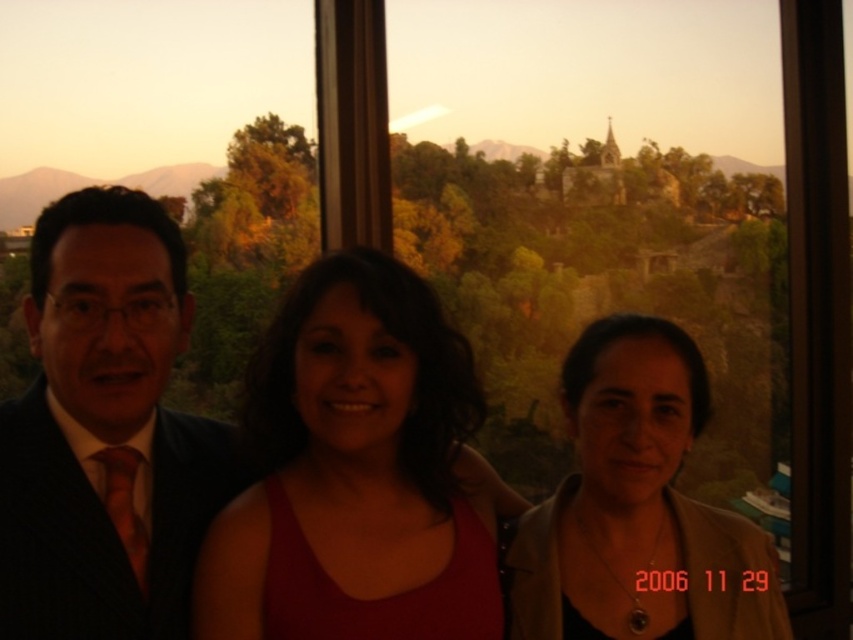
Is matte black suit at left shorter than matte red tank top at center?

Incorrect, matte black suit at left's height does not fall short of matte red tank top at center's.

Between matte black suit at left and matte red tank top at center, which one is positioned higher?

matte red tank top at center is above.

Which is in front, point (157, 536) or point (476, 524)?

Point (157, 536) is in front.

The height and width of the screenshot is (640, 853). I want to click on matte black suit at left, so click(106, 436).

Can you confirm if matte red tank top at center is positioned to the left of matte beige jacket at lower right?

Yes, matte red tank top at center is to the left of matte beige jacket at lower right.

Is point (401, 428) positioned behind point (532, 628)?

That is True.

Between point (447, 544) and point (579, 358), which one is positioned behind?

The point (579, 358) is behind.

Find the location of a particular element. matte red tank top at center is located at coordinates (357, 472).

In the scene shown: Which is above, matte black suit at left or matte beige jacket at lower right?

matte black suit at left is above.

Who is positioned more to the right, matte black suit at left or matte beige jacket at lower right?

From the viewer's perspective, matte beige jacket at lower right appears more on the right side.

Does point (90, 372) come behind point (695, 618)?

No.

What are the coordinates of `matte black suit at left` in the screenshot? It's located at point(106,436).